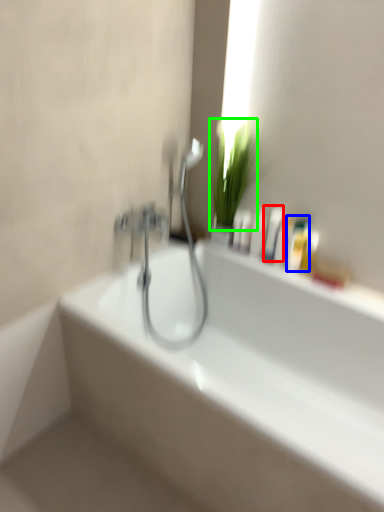
Question: Considering the real-world distances, which object is farthest from mouthwash (highlighted by a red box)? mouthwash (highlighted by a blue box) or plant (highlighted by a green box)?

Choices:
 (A) mouthwash
 (B) plant

Answer: (B)